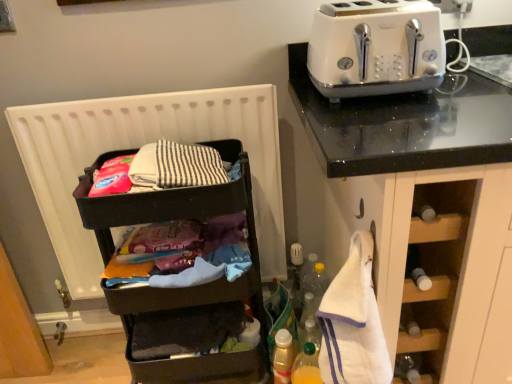
Question: Do you think translucent plastic bottle at lower center, the second bottle from the right, is within translucent plastic bottle at lower center, the second bottle positioned from the left, or outside of it?

Choices:
 (A) inside
 (B) outside

Answer: (B)

Question: Considering the positions of translucent plastic bottle at lower center, the second bottle from the right, and translucent plastic bottle at lower center, the second bottle positioned from the left, in the image, is translucent plastic bottle at lower center, the second bottle from the right, bigger or smaller than translucent plastic bottle at lower center, the second bottle positioned from the left,?

Choices:
 (A) big
 (B) small

Answer: (B)

Question: Based on their relative distances, which object is nearer to the translucent plastic bottle at lower center, placed as the 1th bottle when sorted from left to right?

Choices:
 (A) white glossy toaster at upper right
 (B) white matte radiator at left
 (C) black plastic shelf at left
 (D) translucent plastic bottle at lower center, the second bottle positioned from the left
 (E) white terry cloth at right

Answer: (D)

Question: Based on their relative distances, which object is farther from the translucent plastic bottle at lower center, placed as the 1th bottle when sorted from left to right?

Choices:
 (A) black plastic shelf at left
 (B) white matte radiator at left
 (C) white terry cloth at right
 (D) translucent plastic bottle at lower center, the second bottle positioned from the left
 (E) white glossy toaster at upper right

Answer: (E)